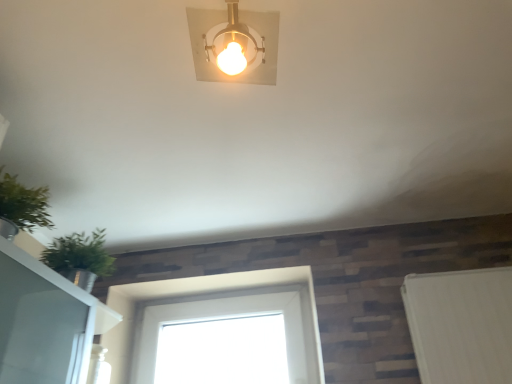
Question: Is white glass window at center with gold metallic light fixture at upper center?

Choices:
 (A) yes
 (B) no

Answer: (B)

Question: Is white glass window at center completely or partially outside of gold metallic light fixture at upper center?

Choices:
 (A) no
 (B) yes

Answer: (B)

Question: Does white glass window at center have a larger size compared to gold metallic light fixture at upper center?

Choices:
 (A) yes
 (B) no

Answer: (A)

Question: Is white glass window at center oriented towards gold metallic light fixture at upper center?

Choices:
 (A) yes
 (B) no

Answer: (A)

Question: Considering the relative sizes of white glass window at center and gold metallic light fixture at upper center in the image provided, is white glass window at center thinner than gold metallic light fixture at upper center?

Choices:
 (A) no
 (B) yes

Answer: (B)

Question: Is white glass window at center taller than gold metallic light fixture at upper center?

Choices:
 (A) no
 (B) yes

Answer: (B)

Question: Can you confirm if green leafy plant at left is positioned to the right of white glass window at center?

Choices:
 (A) no
 (B) yes

Answer: (A)

Question: Considering the relative sizes of green leafy plant at left and white glass window at center in the image provided, is green leafy plant at left thinner than white glass window at center?

Choices:
 (A) no
 (B) yes

Answer: (A)

Question: Is green leafy plant at left completely or partially outside of white glass window at center?

Choices:
 (A) yes
 (B) no

Answer: (A)

Question: Does green leafy plant at left come behind white glass window at center?

Choices:
 (A) no
 (B) yes

Answer: (A)

Question: Is green leafy plant at left surrounding white glass window at center?

Choices:
 (A) yes
 (B) no

Answer: (B)

Question: Does green leafy plant at left turn towards white glass window at center?

Choices:
 (A) yes
 (B) no

Answer: (B)

Question: From a real-world perspective, is green leafy plant at left located beneath gold metallic light fixture at upper center?

Choices:
 (A) yes
 (B) no

Answer: (A)